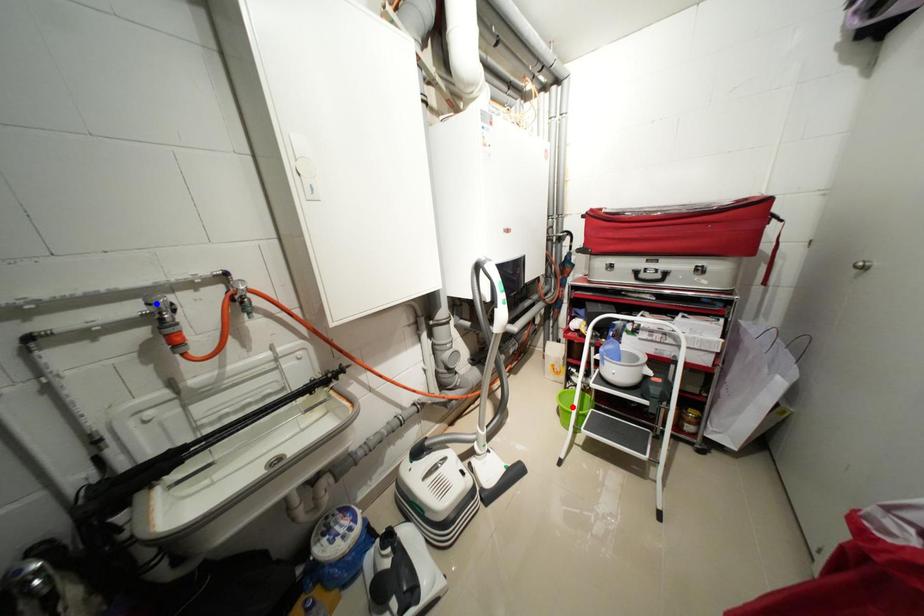
Question: In the image, two points are highlighted. Which point is nearer to the camera? Reply with the corresponding letter.

Choices:
 (A) blue point
 (B) red point

Answer: (A)